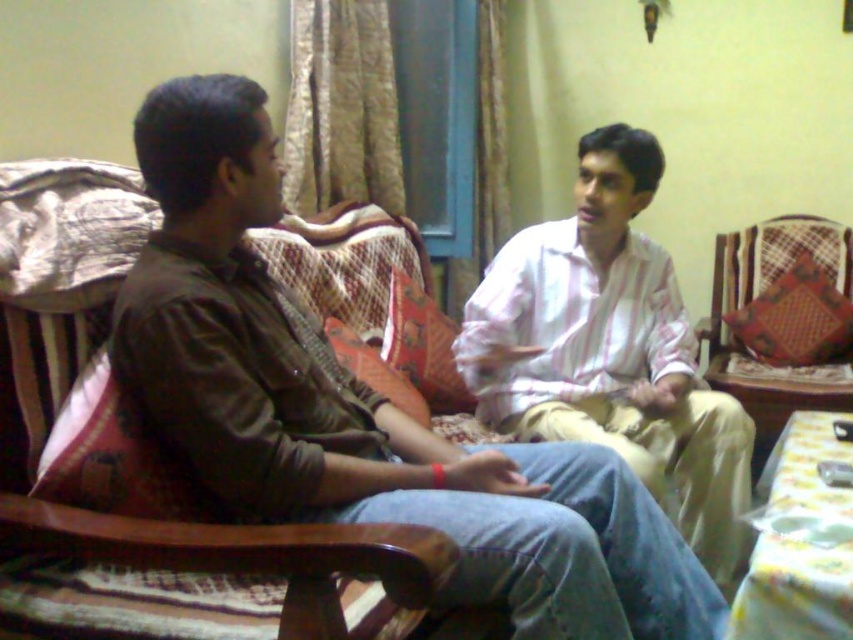
You are standing in the room and want to hand a book to the person wearing the dark brown shirt at left and the wooden chair at right. Which one should you approach first to reach them both efficiently?

Since the dark brown shirt at left is closer to the viewer than the wooden chair at right, you should approach the dark brown shirt at left first to reach them both efficiently.

You are sitting in a cozy living room and see two people wearing the dark brown shirt at left and the pink striped shirt at center. Which person is sitting lower in position compared to the other?

The dark brown shirt at left is positioned under the pink striped shirt at center, so the person wearing the dark brown shirt at left is sitting lower than the other person.

You are a photographer trying to capture both the dark brown shirt at left and the pink striped shirt at center in a single shot. Since you want both subjects to be in focus, which one should you adjust your camera focus on first?

You should focus on the dark brown shirt at left first because it is closer to the viewer than the pink striped shirt at center. This way, adjusting focus starting from the closer subject ensures both will be in focus when using depth of field appropriately.